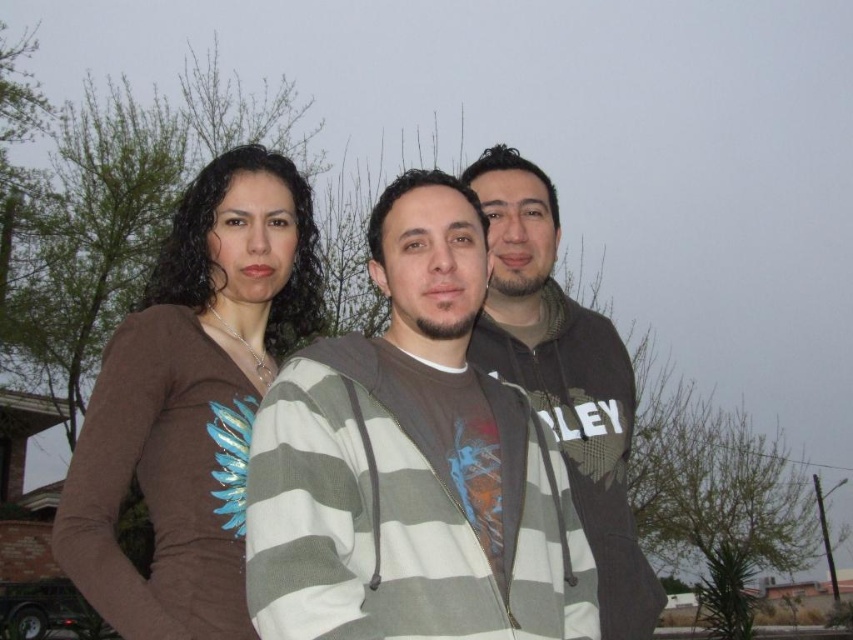
Question: Which object is positioned closest to the brown matte shirt at upper left?

Choices:
 (A) dark gray zip-up hoodie at center
 (B) brown matte shirt at left

Answer: (A)

Question: Observing the image, what is the correct spatial positioning of brown matte shirt at left in reference to brown matte shirt at upper left?

Choices:
 (A) above
 (B) below

Answer: (B)

Question: Is the position of dark gray zip-up hoodie at center more distant than that of brown matte shirt at upper left?

Choices:
 (A) no
 (B) yes

Answer: (A)

Question: Which point is farther to the camera?

Choices:
 (A) (489, 180)
 (B) (585, 442)

Answer: (A)

Question: Estimate the real-world distances between objects in this image. Which object is closer to the brown matte shirt at upper left?

Choices:
 (A) dark gray zip-up hoodie at center
 (B) brown matte shirt at left

Answer: (A)

Question: Can you confirm if dark gray zip-up hoodie at center is thinner than brown matte shirt at upper left?

Choices:
 (A) yes
 (B) no

Answer: (A)